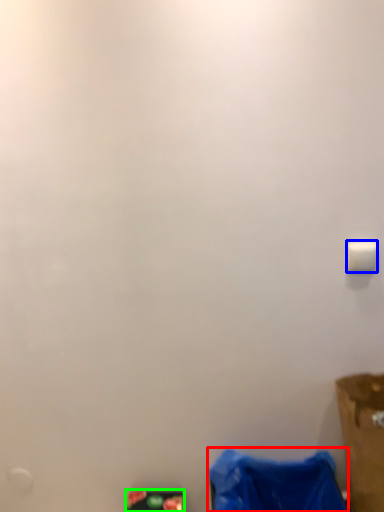
Question: Which is farther away from waste (highlighted by a red box)? light switch (highlighted by a blue box) or waste (highlighted by a green box)?

Choices:
 (A) light switch
 (B) waste

Answer: (A)